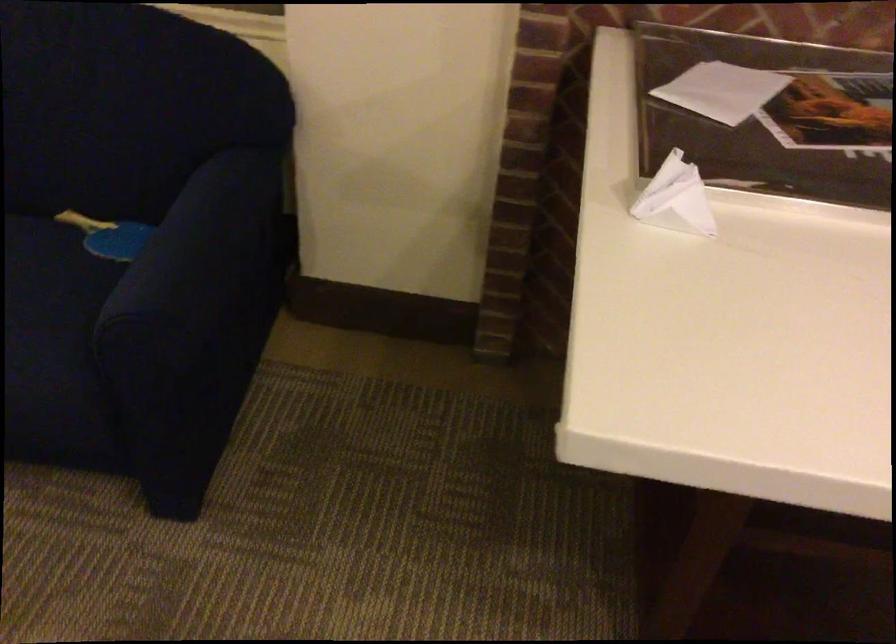
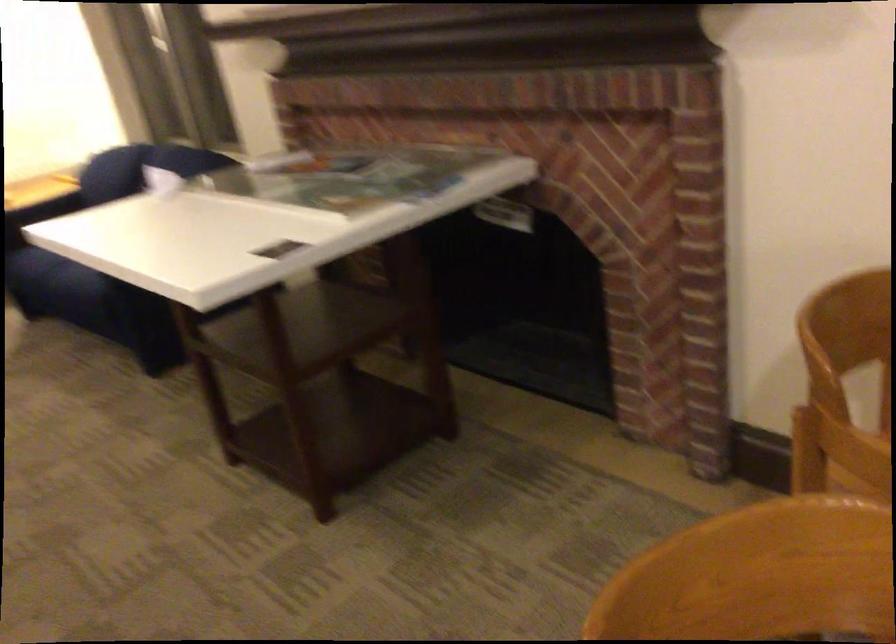
Question: I am providing you with two images of the same scene from different viewpoints. Please identify which objects are invisible in image2.

Choices:
 (A) blue toothpaste tube
 (B) blue sofa sitting surface
 (C) sofa sitting surface
 (D) sofa armrest

Answer: (B)